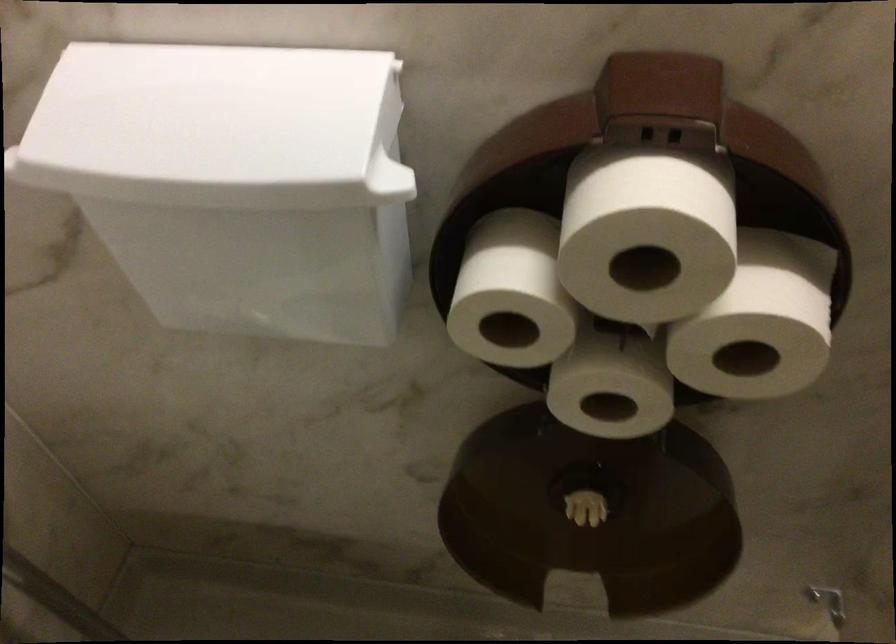
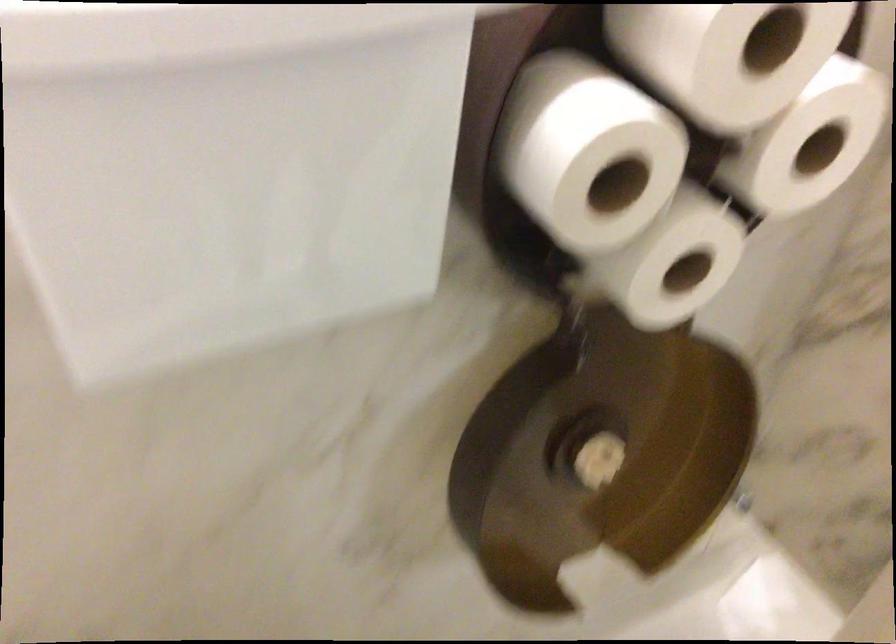
Where in the second image is the point corresponding to [631,389] from the first image?

(672, 261)